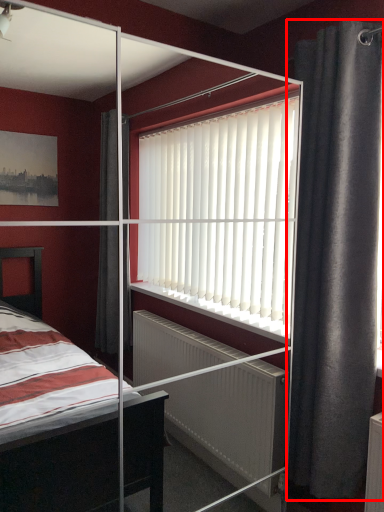
Question: From the image's perspective, considering the relative positions of curtain (annotated by the red box) and screen door in the image provided, where is curtain (annotated by the red box) located with respect to the staircase?

Choices:
 (A) above
 (B) below

Answer: (A)